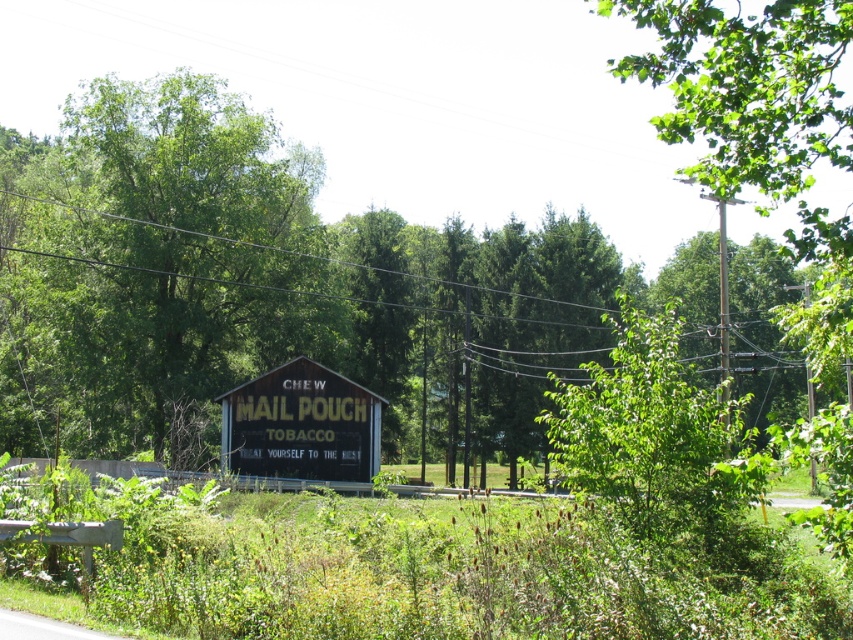
Does green leafy tree at center appear under yellow wooden signboard at center?

No, green leafy tree at center is not below yellow wooden signboard at center.

Can you confirm if green leafy tree at center is positioned above yellow wooden signboard at center?

Correct, green leafy tree at center is located above yellow wooden signboard at center.

Looking at this image, who is more distant from viewer, (122, 356) or (334, 474)?

The point (122, 356) is more distant.

At what (x,y) coordinates should I click in order to perform the action: click on green leafy tree at center. Please return your answer as a coordinate pair (x, y). Image resolution: width=853 pixels, height=640 pixels. Looking at the image, I should click on (154, 268).